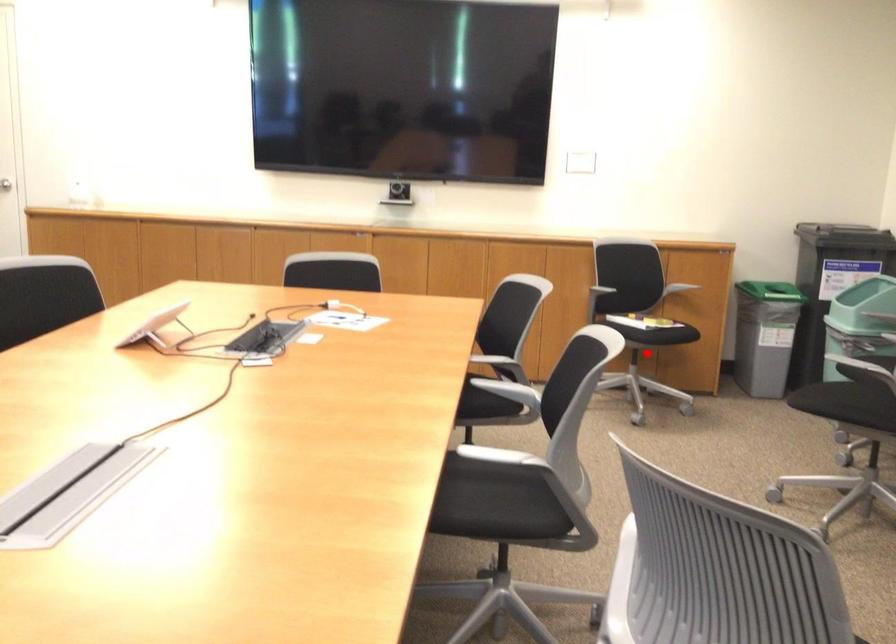
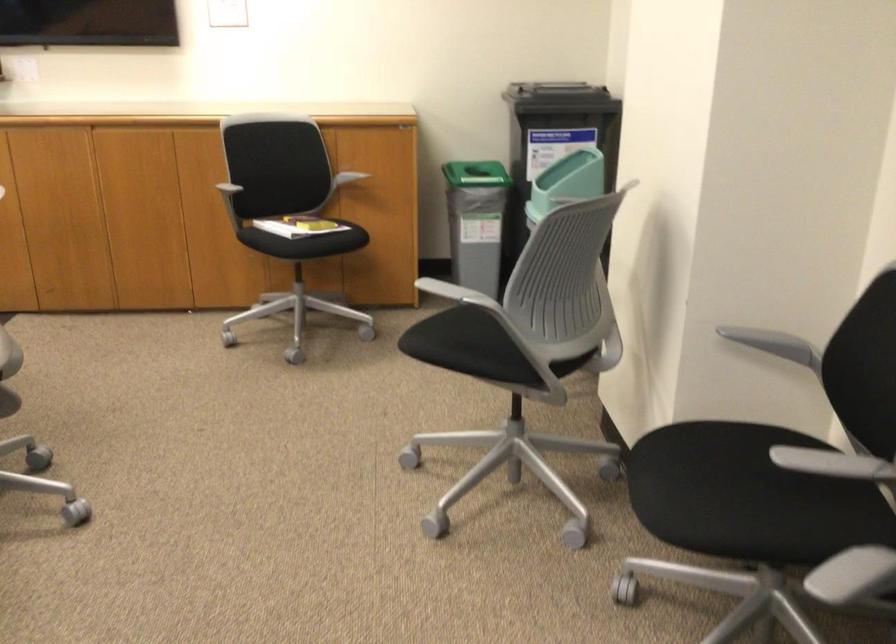
Question: I am providing you with two images of the same scene from different viewpoints. A red point is marked on the first image. At the location where the point appears in image 1, is it still visible in image 2?

Choices:
 (A) Yes
 (B) No

Answer: (B)